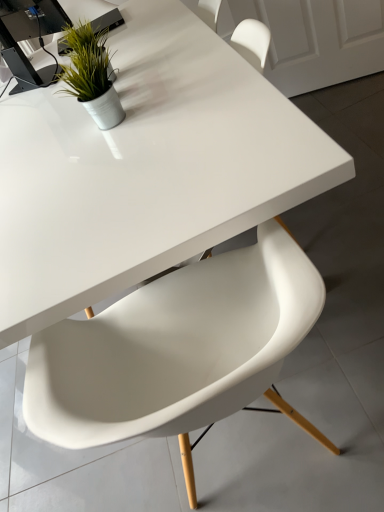
Question: Does white glossy table at center have a smaller size compared to white plastic chair at center?

Choices:
 (A) yes
 (B) no

Answer: (B)

Question: Does white glossy table at center appear on the left side of white plastic chair at center?

Choices:
 (A) yes
 (B) no

Answer: (A)

Question: Is white plastic chair at center at the back of white glossy table at center?

Choices:
 (A) yes
 (B) no

Answer: (B)

Question: Is the depth of white glossy table at center less than that of white plastic chair at center?

Choices:
 (A) yes
 (B) no

Answer: (B)

Question: Does white glossy table at center have a lesser height compared to white plastic chair at center?

Choices:
 (A) no
 (B) yes

Answer: (B)

Question: Is black plastic computer desk at upper left taller or shorter than green matte plant at upper left?

Choices:
 (A) short
 (B) tall

Answer: (B)

Question: In terms of width, does black plastic computer desk at upper left look wider or thinner when compared to green matte plant at upper left?

Choices:
 (A) wide
 (B) thin

Answer: (A)

Question: Considering the relative positions of black plastic computer desk at upper left and green matte plant at upper left in the image provided, is black plastic computer desk at upper left to the left or to the right of green matte plant at upper left?

Choices:
 (A) left
 (B) right

Answer: (A)

Question: From the image's perspective, relative to green matte plant at upper left, is black plastic computer desk at upper left above or below?

Choices:
 (A) above
 (B) below

Answer: (A)

Question: From the image's perspective, relative to black plastic computer desk at upper left, is white plastic chair at center above or below?

Choices:
 (A) below
 (B) above

Answer: (A)

Question: Considering the positions of white plastic chair at center and black plastic computer desk at upper left in the image, is white plastic chair at center wider or thinner than black plastic computer desk at upper left?

Choices:
 (A) thin
 (B) wide

Answer: (B)

Question: Is white plastic chair at center in front of or behind black plastic computer desk at upper left in the image?

Choices:
 (A) behind
 (B) front

Answer: (B)

Question: In terms of size, does white plastic chair at center appear bigger or smaller than black plastic computer desk at upper left?

Choices:
 (A) big
 (B) small

Answer: (A)

Question: In terms of height, does green matte plant at upper left look taller or shorter compared to white plastic chair at center?

Choices:
 (A) short
 (B) tall

Answer: (A)

Question: Is green matte plant at upper left in front of or behind white plastic chair at center in the image?

Choices:
 (A) behind
 (B) front

Answer: (A)